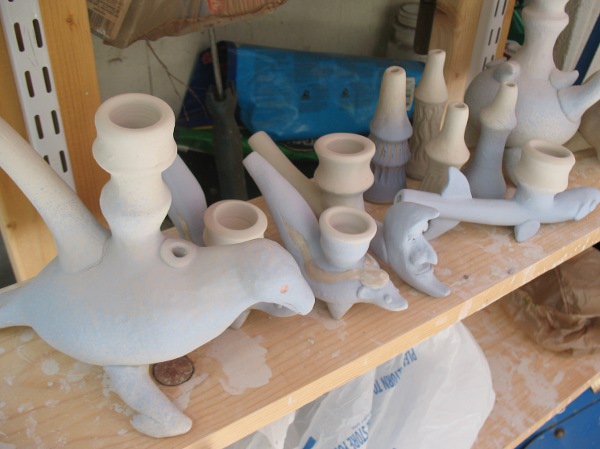
Find the location of a particular element. Image resolution: width=600 pixels, height=449 pixels. candle holder is located at coordinates (120, 284), (233, 223), (341, 255), (347, 168), (533, 198), (487, 158), (450, 148), (427, 114), (386, 153).